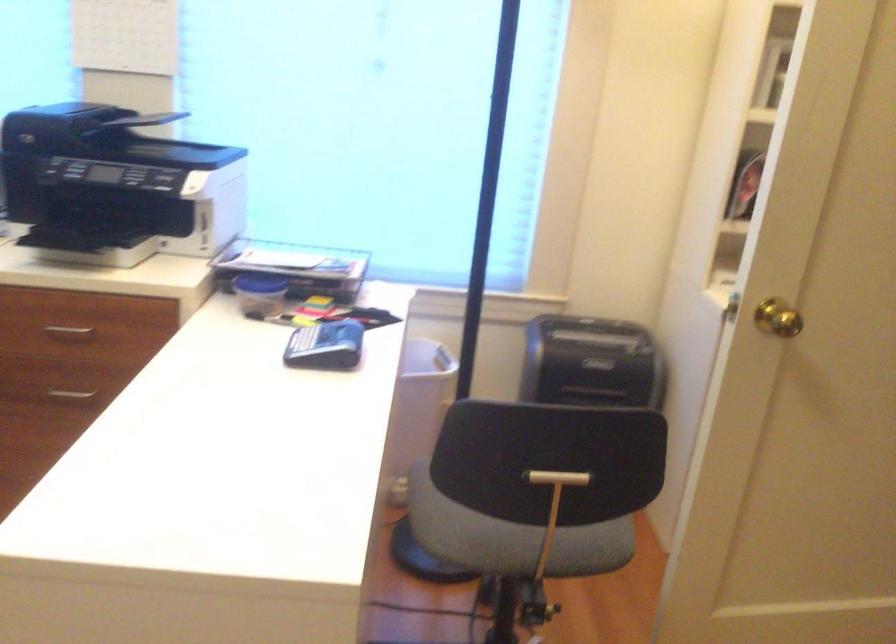
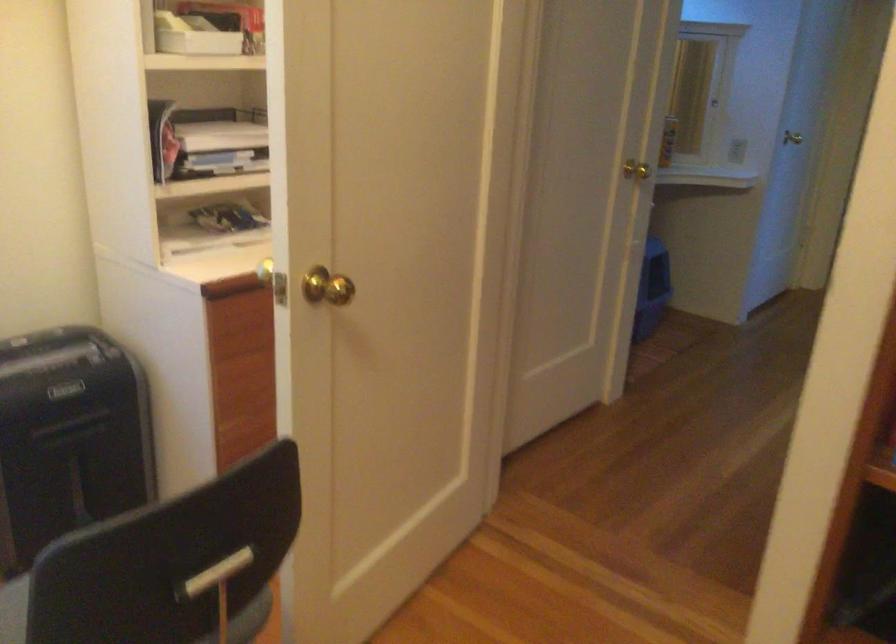
Question: Based on the continuous images, in which direction is the camera rotating? Reply with the corresponding letter.

Choices:
 (A) Left
 (B) Right
 (C) Up
 (D) Down

Answer: (B)